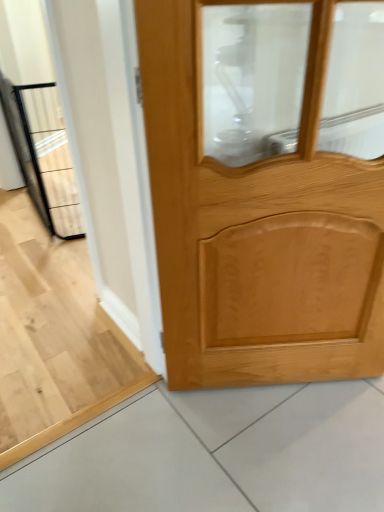
Question: Is light brown wood door at center positioned with its back to black metal elevator at left?

Choices:
 (A) yes
 (B) no

Answer: (B)

Question: Does light brown wood door at center have a lesser width compared to black metal elevator at left?

Choices:
 (A) yes
 (B) no

Answer: (A)

Question: From the image's perspective, is light brown wood door at center on top of black metal elevator at left?

Choices:
 (A) yes
 (B) no

Answer: (B)

Question: Does light brown wood door at center come in front of black metal elevator at left?

Choices:
 (A) yes
 (B) no

Answer: (A)

Question: Is light brown wood door at center far from black metal elevator at left?

Choices:
 (A) no
 (B) yes

Answer: (B)

Question: Is light brown wood door at center smaller than black metal elevator at left?

Choices:
 (A) yes
 (B) no

Answer: (A)

Question: Is black metal elevator at left at the right side of light brown wood door at center?

Choices:
 (A) no
 (B) yes

Answer: (A)

Question: From the image's perspective, is black metal elevator at left above light brown wood door at center?

Choices:
 (A) no
 (B) yes

Answer: (B)

Question: From a real-world perspective, is black metal elevator at left physically below light brown wood door at center?

Choices:
 (A) yes
 (B) no

Answer: (A)

Question: Is the surface of black metal elevator at left in direct contact with light brown wood door at center?

Choices:
 (A) no
 (B) yes

Answer: (A)

Question: Is light brown wood door at center surrounded by black metal elevator at left?

Choices:
 (A) no
 (B) yes

Answer: (A)

Question: Is black metal elevator at left outside light brown wood door at center?

Choices:
 (A) no
 (B) yes

Answer: (B)

Question: In terms of height, does light brown wood door at center look taller or shorter compared to black metal elevator at left?

Choices:
 (A) short
 (B) tall

Answer: (B)